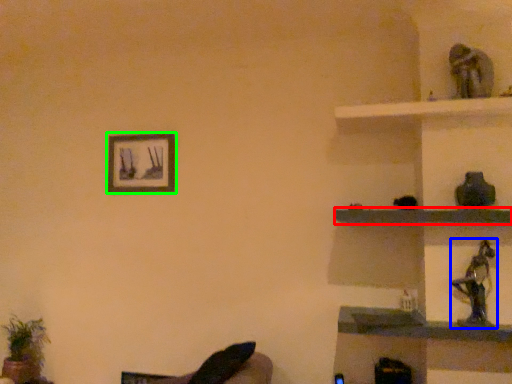
Question: Considering the real-world distances, which object is closest to shelf (highlighted by a red box)? toy (highlighted by a blue box) or picture frame (highlighted by a green box).

Choices:
 (A) toy
 (B) picture frame

Answer: (A)